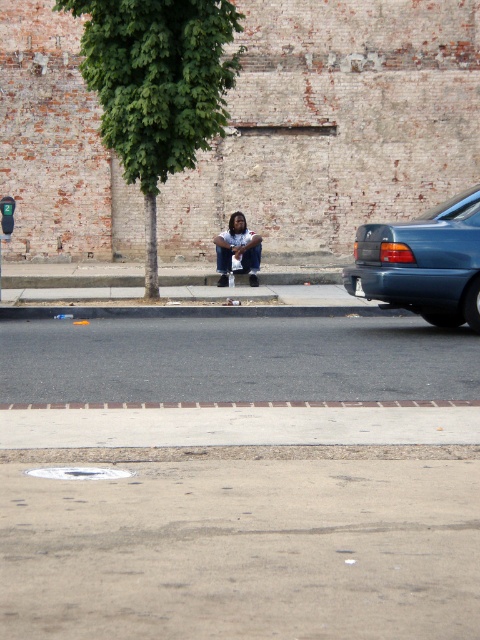
Does teal glossy sedan at right have a greater width compared to dark blue jeans at center?

Yes.

Is the position of teal glossy sedan at right less distant than that of dark blue jeans at center?

Yes.

Between point (411, 227) and point (236, 218), which one is positioned in front?

Point (411, 227) is in front.

Where is `teal glossy sedan at right`? This screenshot has height=640, width=480. teal glossy sedan at right is located at coordinates (423, 262).

Is gray asphalt at center shorter than dark blue jeans at center?

Indeed, gray asphalt at center has a lesser height compared to dark blue jeans at center.

Between gray asphalt at center and dark blue jeans at center, which one appears on the right side from the viewer's perspective?

dark blue jeans at center is more to the right.

The width and height of the screenshot is (480, 640). Identify the location of gray asphalt at center. (236, 358).

Can you confirm if smooth concrete pavement at lower center is positioned below dark blue jeans at center?

Correct, smooth concrete pavement at lower center is located below dark blue jeans at center.

Based on the photo, can you confirm if smooth concrete pavement at lower center is bigger than dark blue jeans at center?

Indeed, smooth concrete pavement at lower center has a larger size compared to dark blue jeans at center.

Identify the location of smooth concrete pavement at lower center. The height and width of the screenshot is (640, 480). (243, 550).